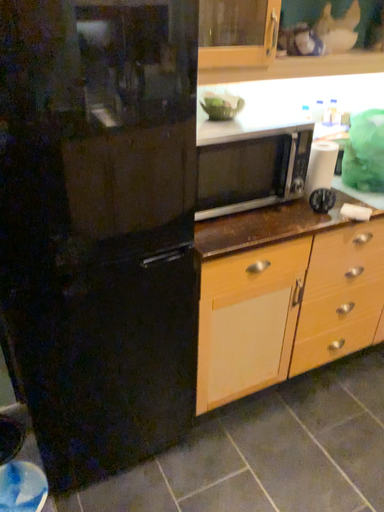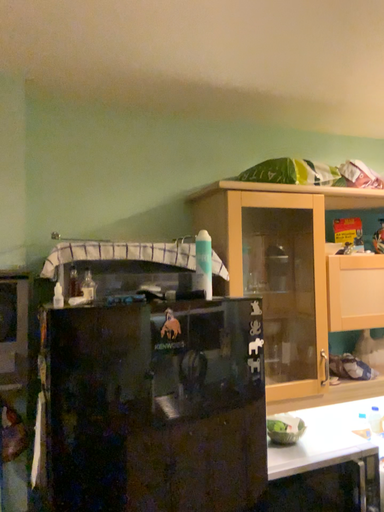
Question: Which way did the camera rotate in the video?

Choices:
 (A) rotated upward
 (B) rotated downward

Answer: (A)